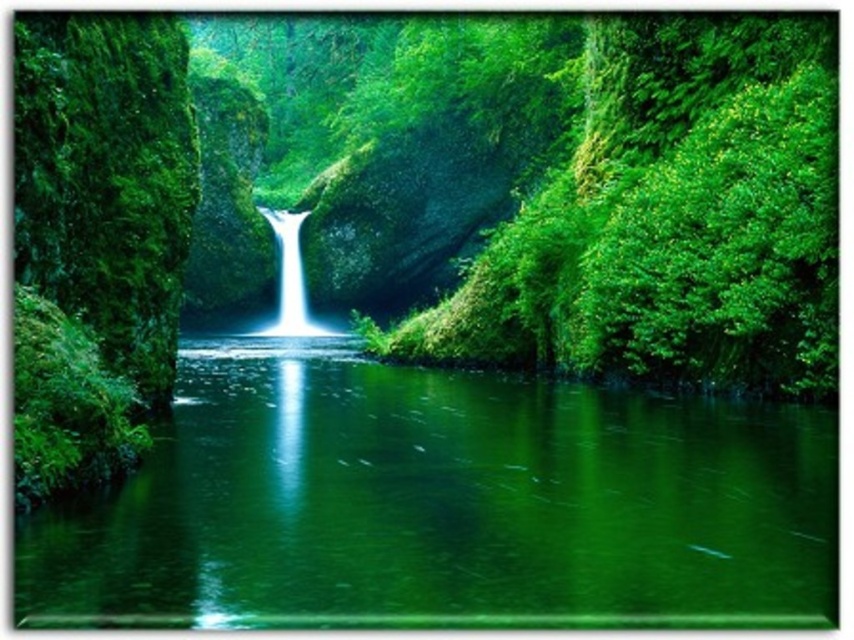
You are a hiker standing at the edge of the green mossy rock at left, looking towards the green glossy river at center. Which object is taller from your perspective?

The green mossy rock at left is taller than the green glossy river at center from your perspective.

Looking at this image, you are an environmental scientist assessing the water quality of the green glossy river at center and the white smooth waterfall at center. Which of these two water bodies has a larger surface area?

The green glossy river at center has a larger size compared to the white smooth waterfall at center, so the green glossy river at center has a larger surface area.

You are a photographer planning to capture the green glossy river at center and the green mossy rock at left in a single frame. Based on the scene, which object will occupy more of the frame?

The green glossy river at center will occupy more of the frame since it is larger in size than the green mossy rock at left according to the description.